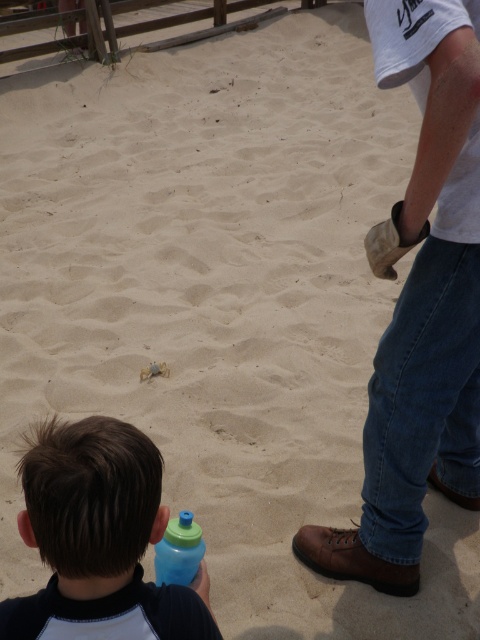
You are a beach cleanup volunteer and need to decide which bottle to pick up first. The blue matte water bottle at lower left and the blue translucent bottle at lower center are both on the sand. Which one is wider?

The blue matte water bottle at lower left is wider than the blue translucent bottle at lower center.

You are a beachcomber searching for items on the beach. You see the brown leather shoe at lower right and the blue translucent bottle at lower center. Which item would you estimate is bigger in size?

The brown leather shoe at lower right is larger in size compared to the blue translucent bottle at lower center.

You are a robot with a 70 cm wide arm. You need to pick up the brown leather shoe at lower right and the blue matte water bottle at lower left. Can your arm fit between them to grab both items?

The brown leather shoe at lower right and the blue matte water bottle at lower left are 86.13 centimeters apart from each other. Since your arm is 70 cm wide, it can fit between them as 70 cm is less than 86.13 cm.